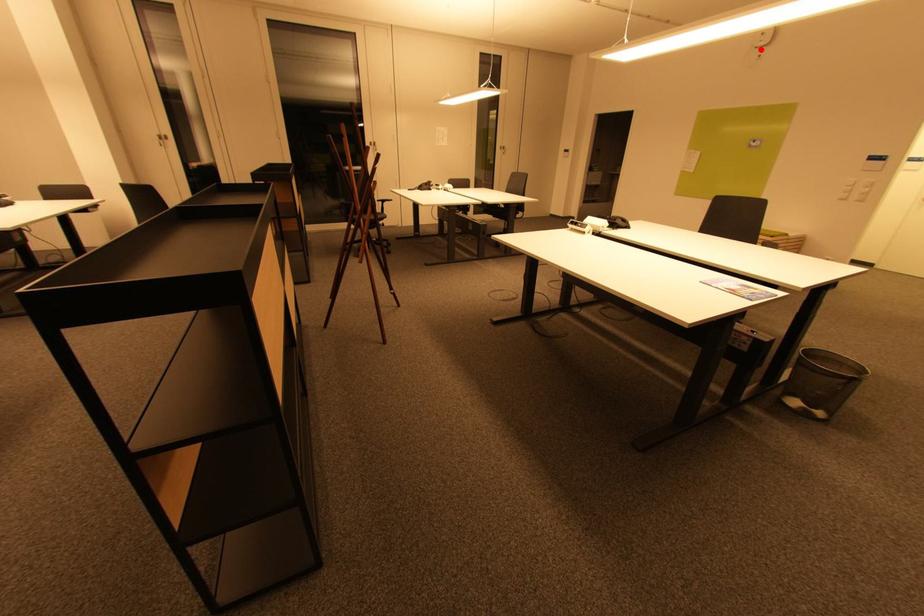
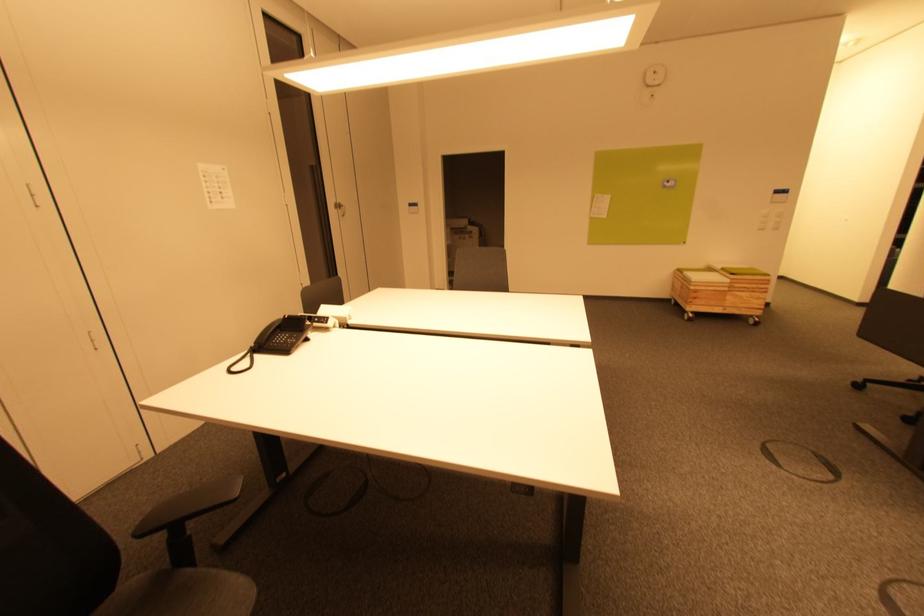
Question: I am providing you with two images of the same scene from different viewpoints. Given a red point in image1, look at the same physical point in image2. Is it:

Choices:
 (A) Closer to the viewpoint
 (B) Farther from the viewpoint

Answer: (B)